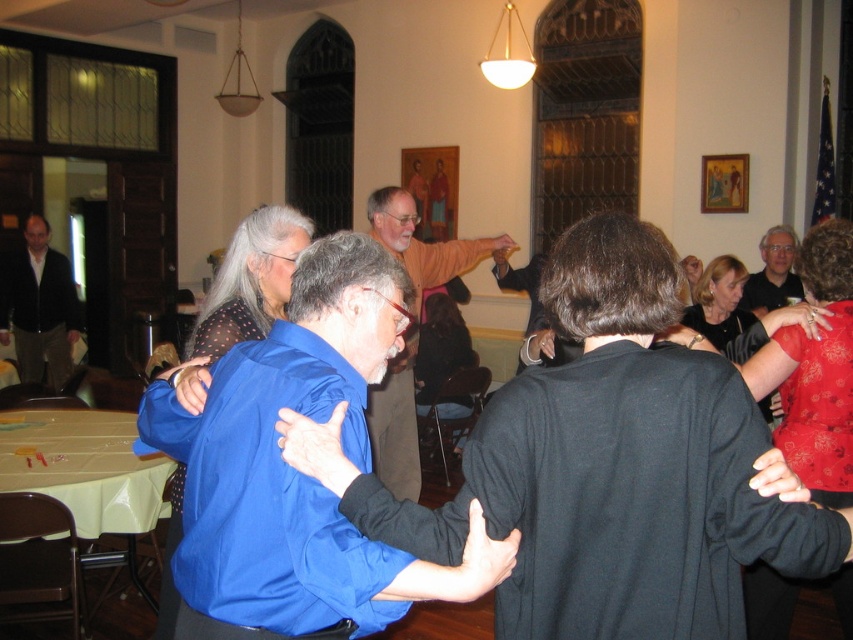
Is orange cotton shirt at center further to the viewer compared to matte black jacket at left?

That is False.

Which is behind, point (403, 412) or point (45, 269)?

Point (45, 269)

The height and width of the screenshot is (640, 853). I want to click on orange cotton shirt at center, so click(x=422, y=243).

Is blue satin shirt at center below matte black jacket at left?

Yes.

Who is more distant from viewer, (248, 628) or (42, 276)?

Point (42, 276)

Where is `blue satin shirt at center`? The width and height of the screenshot is (853, 640). blue satin shirt at center is located at coordinates (299, 472).

Who is positioned more to the right, matte black jacket at left or matte black shirt at upper right?

From the viewer's perspective, matte black shirt at upper right appears more on the right side.

In the scene shown: Can you confirm if matte black jacket at left is smaller than matte black shirt at upper right?

Actually, matte black jacket at left might be larger than matte black shirt at upper right.

Is point (44, 227) more distant than point (762, 294)?

Yes.

You are a GUI agent. You are given a task and a screenshot of the screen. Output one action in this format:
    pyautogui.click(x=<x>, y=<y>)
    Task: Click on the matte black jacket at left
    This screenshot has width=853, height=640.
    Given the screenshot: What is the action you would take?
    pyautogui.click(x=39, y=307)